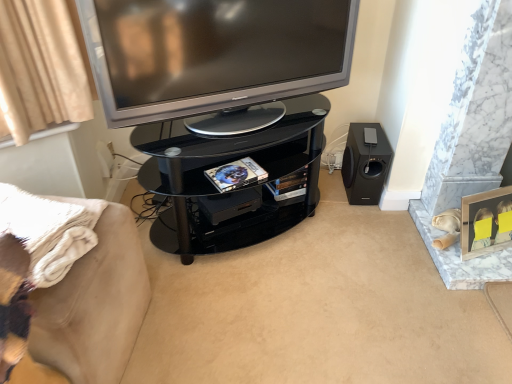
Question: Does black matte speaker at lower right touch black glass tv cabinet at center?

Choices:
 (A) yes
 (B) no

Answer: (B)

Question: From the image's perspective, is black matte speaker at lower right located above black glass tv cabinet at center?

Choices:
 (A) yes
 (B) no

Answer: (A)

Question: Is black matte speaker at lower right to the left of black glass tv cabinet at center from the viewer's perspective?

Choices:
 (A) yes
 (B) no

Answer: (B)

Question: Would you say black glass tv cabinet at center is part of black matte speaker at lower right's contents?

Choices:
 (A) no
 (B) yes

Answer: (A)

Question: Is black matte speaker at lower right behind black glass tv cabinet at center?

Choices:
 (A) no
 (B) yes

Answer: (B)

Question: Is black matte speaker at lower right positioned far away from black glass tv cabinet at center?

Choices:
 (A) no
 (B) yes

Answer: (A)

Question: From a real-world perspective, is silver metallic television at upper center on top of black glass tv cabinet at center?

Choices:
 (A) no
 (B) yes

Answer: (B)

Question: Is silver metallic television at upper center looking in the opposite direction of black glass tv cabinet at center?

Choices:
 (A) no
 (B) yes

Answer: (A)

Question: Is silver metallic television at upper center aimed at black glass tv cabinet at center?

Choices:
 (A) yes
 (B) no

Answer: (B)

Question: Can you see silver metallic television at upper center touching black glass tv cabinet at center?

Choices:
 (A) yes
 (B) no

Answer: (B)

Question: Does silver metallic television at upper center appear on the left side of black glass tv cabinet at center?

Choices:
 (A) no
 (B) yes

Answer: (A)

Question: From the image's perspective, would you say silver metallic television at upper center is shown under black glass tv cabinet at center?

Choices:
 (A) yes
 (B) no

Answer: (B)

Question: Is beige fabric couch at lower left not within black glass tv cabinet at center?

Choices:
 (A) yes
 (B) no

Answer: (A)